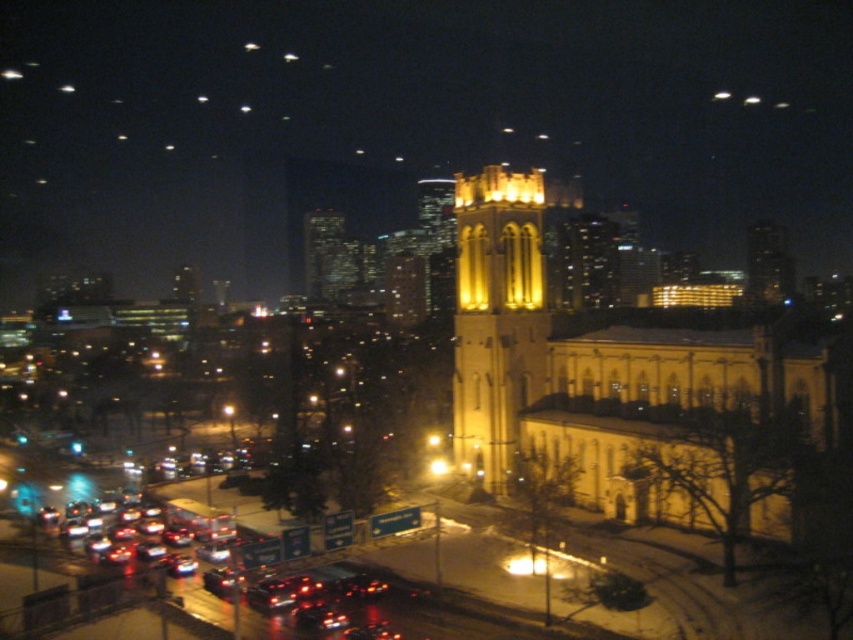
Based on the photo, can you confirm if yellow stone tower at center is shorter than shiny black car at lower left?

Incorrect, yellow stone tower at center's height does not fall short of shiny black car at lower left's.

Is yellow stone tower at center bigger than shiny black car at lower left?

Yes.

Which is in front, point (519, 276) or point (107, 580)?

Point (107, 580) is in front.

This screenshot has width=853, height=640. What are the coordinates of `yellow stone tower at center` in the screenshot? It's located at (496, 317).

Describe the element at coordinates (602, 374) in the screenshot. I see `yellow stone church at center` at that location.

Between point (494, 369) and point (508, 397), which one is positioned in front?

Point (508, 397) is more forward.

The width and height of the screenshot is (853, 640). What do you see at coordinates (602, 374) in the screenshot?
I see `yellow stone church at center` at bounding box center [602, 374].

Where is `yellow stone church at center`? yellow stone church at center is located at coordinates (602, 374).

Between yellow stone church at center and shiny black car at lower left, which one has more height?

yellow stone church at center is taller.

Based on the photo, which is more to the left, yellow stone church at center or shiny black car at lower left?

shiny black car at lower left is more to the left.

Who is more forward, (721, 355) or (134, 602)?

Point (134, 602)

Where is `yellow stone church at center`? Image resolution: width=853 pixels, height=640 pixels. yellow stone church at center is located at coordinates (602, 374).